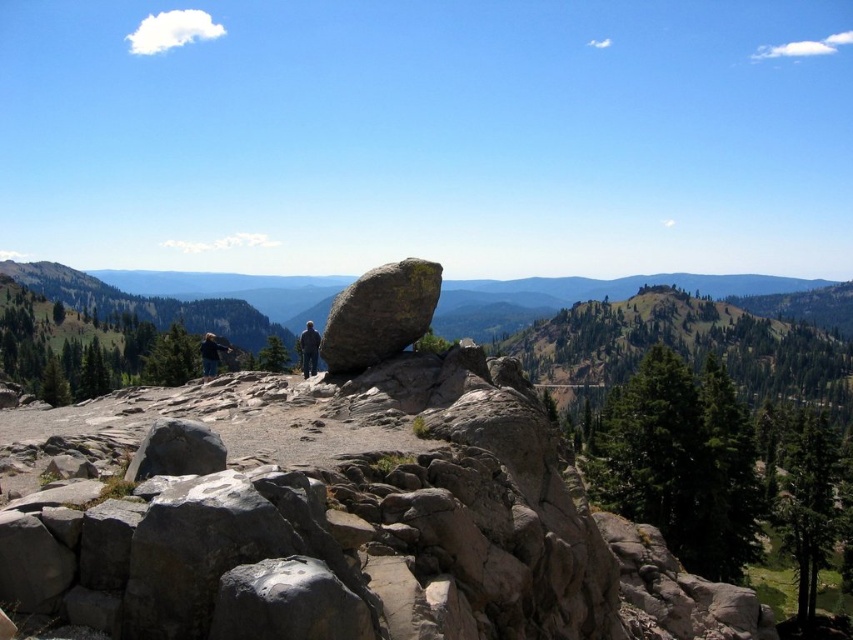
Question: Is smooth gray rock at center wider than dark blue jeans at center?

Choices:
 (A) no
 (B) yes

Answer: (A)

Question: Which of the following is the closest to the observer?

Choices:
 (A) dark gray fabric pants at center
 (B) smooth gray rock at center
 (C) dark blue jeans at center

Answer: (B)

Question: Is the position of smooth gray rock at center more distant than that of dark gray fabric pants at center?

Choices:
 (A) yes
 (B) no

Answer: (B)

Question: Is smooth gray rock at center bigger than dark gray fabric pants at center?

Choices:
 (A) no
 (B) yes

Answer: (A)

Question: Which object is closer to the camera taking this photo?

Choices:
 (A) dark blue jeans at center
 (B) smooth gray rock at center

Answer: (B)

Question: Which of the following is the closest to the observer?

Choices:
 (A) (305, 348)
 (B) (207, 337)
 (C) (397, 337)

Answer: (C)